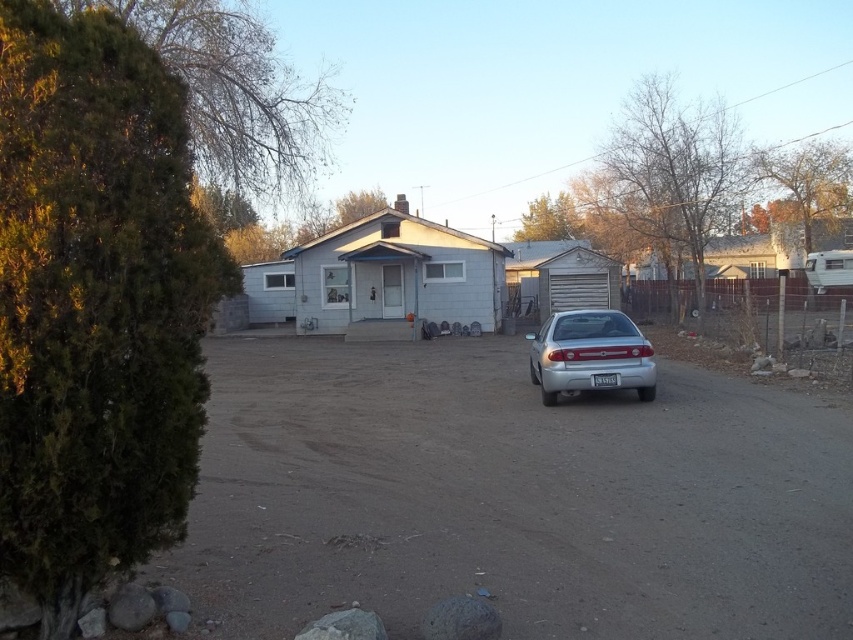
Question: Is dirt track at center smaller than silver metallic sedan at center?

Choices:
 (A) yes
 (B) no

Answer: (B)

Question: Which point is farther to the camera?

Choices:
 (A) (553, 324)
 (B) (421, 584)

Answer: (A)

Question: Which point is farther from the camera taking this photo?

Choices:
 (A) (209, 342)
 (B) (650, 388)

Answer: (A)

Question: From the image, what is the correct spatial relationship of dirt track at center in relation to silver metallic sedan at center?

Choices:
 (A) below
 (B) above

Answer: (A)

Question: Which point is farther to the camera?

Choices:
 (A) dirt track at center
 (B) silver metallic sedan at center

Answer: (B)

Question: Can you confirm if dirt track at center is bigger than silver metallic sedan at center?

Choices:
 (A) no
 (B) yes

Answer: (B)